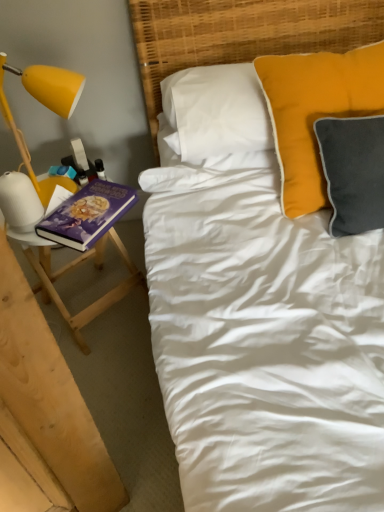
Describe the element at coordinates (240, 34) in the screenshot. I see `woven bamboo headboard at upper center` at that location.

Image resolution: width=384 pixels, height=512 pixels. In order to click on purple matte book at left in this screenshot , I will do `click(87, 214)`.

Find the location of a particular element. The width and height of the screenshot is (384, 512). velvet orange pillow at upper right is located at coordinates (316, 112).

In the image, is yellow matte lamp at left positioned in front of or behind woven bamboo headboard at upper center?

In the image, yellow matte lamp at left appears behind woven bamboo headboard at upper center.

From the image's perspective, would you say yellow matte lamp at left is shown under woven bamboo headboard at upper center?

Correct, yellow matte lamp at left appears lower than woven bamboo headboard at upper center in the image.

Is yellow matte lamp at left next to woven bamboo headboard at upper center?

No, yellow matte lamp at left is not beside woven bamboo headboard at upper center.

Based on the photo, which of these two, yellow matte lamp at left or woven bamboo headboard at upper center, is wider?

woven bamboo headboard at upper center.

Would you say wooden stool at left is inside or outside yellow matte lamp at left?

The correct answer is: outside.

Based on the photo, which of these two, wooden stool at left or yellow matte lamp at left, is thinner?

yellow matte lamp at left.

Is wooden stool at left bigger than yellow matte lamp at left?

Yes.

Considering the relative sizes of wooden stool at left and yellow matte lamp at left in the image provided, is wooden stool at left taller than yellow matte lamp at left?

Yes, wooden stool at left is taller than yellow matte lamp at left.

This screenshot has height=512, width=384. What are the coordinates of `pillow in front of the yellow matte lamp at left` in the screenshot? It's located at (316, 112).

Would you say yellow matte lamp at left is inside or outside velvet orange pillow at upper right?

yellow matte lamp at left exists outside the volume of velvet orange pillow at upper right.

Can you tell me how much yellow matte lamp at left and velvet orange pillow at upper right differ in facing direction?

20.9 degrees separate the facing orientations of yellow matte lamp at left and velvet orange pillow at upper right.

I want to click on lamp lying on the left of woven bamboo headboard at upper center, so click(x=54, y=87).

Considering the sizes of objects woven bamboo headboard at upper center and yellow matte lamp at left in the image provided, who is bigger, woven bamboo headboard at upper center or yellow matte lamp at left?

With larger size is woven bamboo headboard at upper center.

From their relative heights in the image, would you say woven bamboo headboard at upper center is taller or shorter than yellow matte lamp at left?

woven bamboo headboard at upper center is taller than yellow matte lamp at left.

From a real-world perspective, is woven bamboo headboard at upper center located higher than yellow matte lamp at left?

No, from a real-world perspective, woven bamboo headboard at upper center is not over yellow matte lamp at left

Does point (93, 187) come closer to viewer compared to point (46, 258)?

That is True.

From the image's perspective, between purple matte book at left and wooden stool at left, which one is located above?

purple matte book at left appears higher in the image.

Would you say purple matte book at left is inside or outside wooden stool at left?

purple matte book at left exists outside the volume of wooden stool at left.

Is woven bamboo headboard at upper center taller than velvet orange pillow at upper right?

Indeed, woven bamboo headboard at upper center has a greater height compared to velvet orange pillow at upper right.

Consider the image. From the image's perspective, is woven bamboo headboard at upper center above or below velvet orange pillow at upper right?

woven bamboo headboard at upper center is situated higher than velvet orange pillow at upper right in the image.

In the image, is velvet orange pillow at upper right positioned in front of or behind wooden stool at left?

Visually, velvet orange pillow at upper right is located in front of wooden stool at left.

Does velvet orange pillow at upper right have a smaller size compared to wooden stool at left?

Yes.

Based on the photo, can you confirm if velvet orange pillow at upper right is positioned to the left of wooden stool at left?

Incorrect, velvet orange pillow at upper right is not on the left side of wooden stool at left.

Identify the location of headboard in front of the yellow matte lamp at left. The height and width of the screenshot is (512, 384). (240, 34).

The width and height of the screenshot is (384, 512). In order to click on lamp above the wooden stool at left (from the image's perspective) in this screenshot , I will do `click(54, 87)`.

Estimate the real-world distances between objects in this image. Which object is further from woven bamboo headboard at upper center, wooden stool at left or velvet orange pillow at upper right?

wooden stool at left.

From the image, which object appears to be nearer to velvet orange pillow at upper right, wooden stool at left or yellow matte lamp at left?

yellow matte lamp at left.

From the image, which object appears to be farther from woven bamboo headboard at upper center, wooden stool at left or purple matte book at left?

wooden stool at left is further to woven bamboo headboard at upper center.

Based on their spatial positions, is yellow matte lamp at left or woven bamboo headboard at upper center closer to purple matte book at left?

yellow matte lamp at left is positioned closer to the anchor purple matte book at left.

Considering their positions, is purple matte book at left positioned closer to yellow matte lamp at left than woven bamboo headboard at upper center?

purple matte book at left.

In the scene shown: Estimate the real-world distances between objects in this image. Which object is closer to purple matte book at left, velvet orange pillow at upper right or wooden stool at left?

The object closer to purple matte book at left is wooden stool at left.

From the image, which object appears to be farther from wooden stool at left, velvet orange pillow at upper right or woven bamboo headboard at upper center?

velvet orange pillow at upper right.

When comparing their distances from wooden stool at left, does velvet orange pillow at upper right or yellow matte lamp at left seem closer?

yellow matte lamp at left is closer to wooden stool at left.

Image resolution: width=384 pixels, height=512 pixels. I want to click on paperback book between yellow matte lamp at left and wooden stool at left in the up-down direction, so click(87, 214).

Identify the location of headboard between purple matte book at left and velvet orange pillow at upper right. This screenshot has height=512, width=384. (240, 34).

Find the location of a particular element. The width and height of the screenshot is (384, 512). paperback book between yellow matte lamp at left and woven bamboo headboard at upper center in the horizontal direction is located at coordinates (87, 214).

Find the location of a particular element. This screenshot has width=384, height=512. paperback book situated between wooden stool at left and woven bamboo headboard at upper center from left to right is located at coordinates (87, 214).